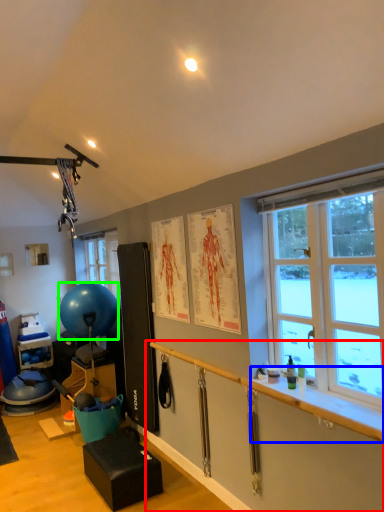
Question: Based on their relative distances, which object is farther from garage door (highlighted by a red box)? Choose from window sill (highlighted by a blue box) and ball (highlighted by a green box).

Choices:
 (A) window sill
 (B) ball

Answer: (B)